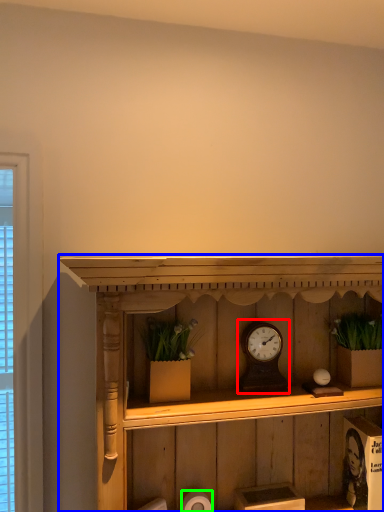
Question: Which is nearer to the alarm clock (highlighted by a red box)? shelf (highlighted by a blue box) or toilet paper (highlighted by a green box).

Choices:
 (A) shelf
 (B) toilet paper

Answer: (A)